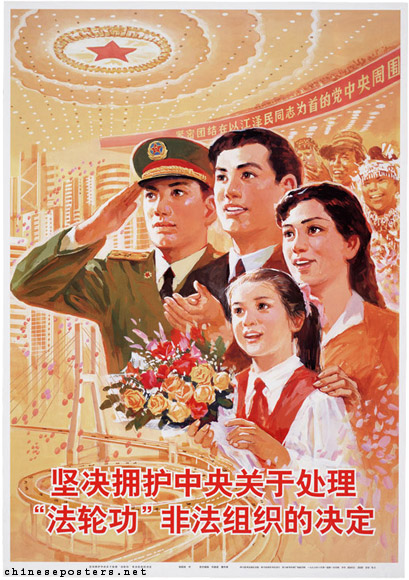
Image resolution: width=409 pixels, height=580 pixels. Identify the location of bouquet. (162, 394).